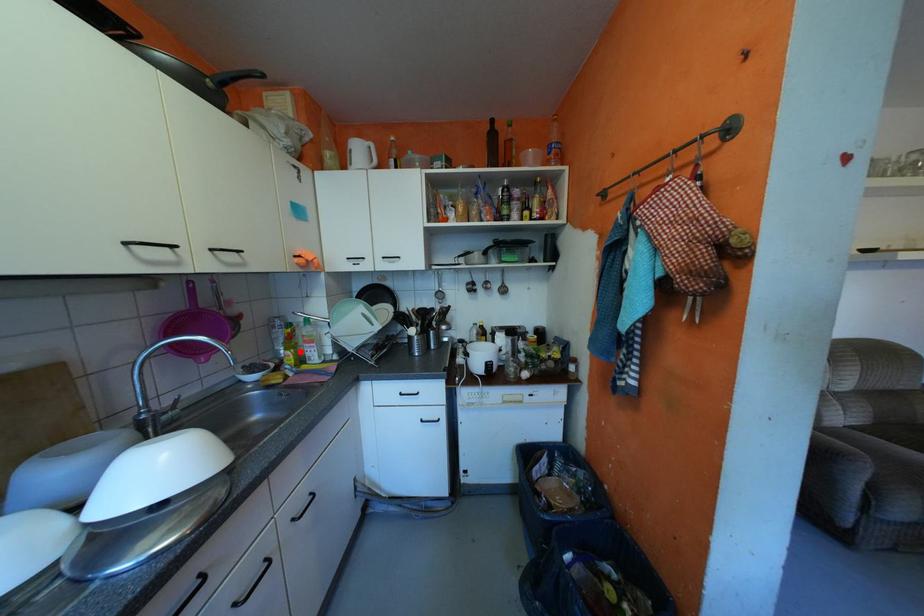
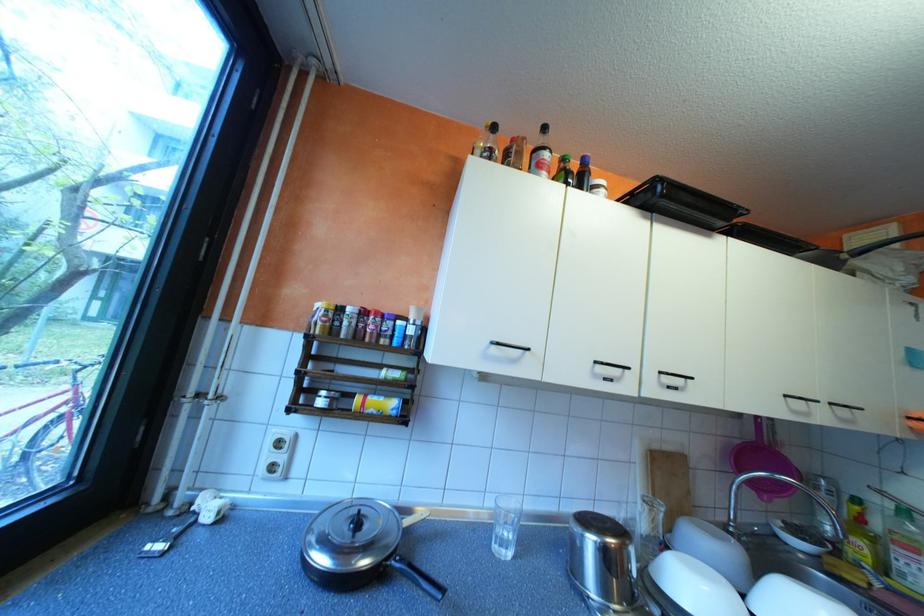
Locate, in the second image, the point that corresponds to the highlighted location in the first image.

(871, 541)